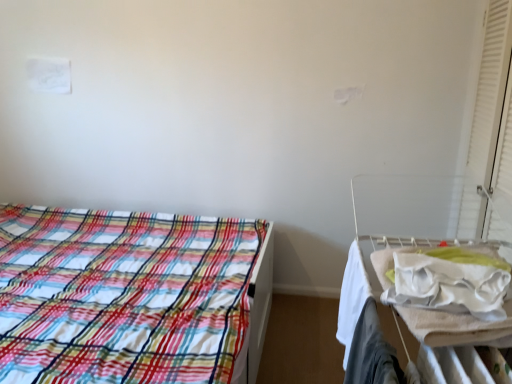
Question: Is white matte curtain at right far from white fabric hospital bed at right?

Choices:
 (A) yes
 (B) no

Answer: (B)

Question: Is white matte curtain at right not within white fabric hospital bed at right?

Choices:
 (A) yes
 (B) no

Answer: (A)

Question: Is white matte curtain at right positioned with its back to white fabric hospital bed at right?

Choices:
 (A) yes
 (B) no

Answer: (B)

Question: Does white matte curtain at right have a larger size compared to white fabric hospital bed at right?

Choices:
 (A) yes
 (B) no

Answer: (B)

Question: Is white matte curtain at right to the right of white fabric hospital bed at right from the viewer's perspective?

Choices:
 (A) yes
 (B) no

Answer: (A)

Question: Does white matte curtain at right have a lesser height compared to white fabric hospital bed at right?

Choices:
 (A) no
 (B) yes

Answer: (A)

Question: Considering the relative sizes of plaid fabric bed at left and white fabric hospital bed at right in the image provided, is plaid fabric bed at left thinner than white fabric hospital bed at right?

Choices:
 (A) no
 (B) yes

Answer: (A)

Question: Can you confirm if plaid fabric bed at left is positioned to the left of white fabric hospital bed at right?

Choices:
 (A) yes
 (B) no

Answer: (A)

Question: From the image's perspective, is plaid fabric bed at left below white fabric hospital bed at right?

Choices:
 (A) no
 (B) yes

Answer: (A)

Question: Is plaid fabric bed at left wider than white fabric hospital bed at right?

Choices:
 (A) yes
 (B) no

Answer: (A)

Question: Considering the relative sizes of plaid fabric bed at left and white fabric hospital bed at right in the image provided, is plaid fabric bed at left shorter than white fabric hospital bed at right?

Choices:
 (A) no
 (B) yes

Answer: (B)

Question: Considering the relative positions of plaid fabric bed at left and white fabric hospital bed at right in the image provided, is plaid fabric bed at left in front of white fabric hospital bed at right?

Choices:
 (A) yes
 (B) no

Answer: (B)

Question: Are white matte curtain at right and plaid fabric bed at left located far from each other?

Choices:
 (A) no
 (B) yes

Answer: (B)